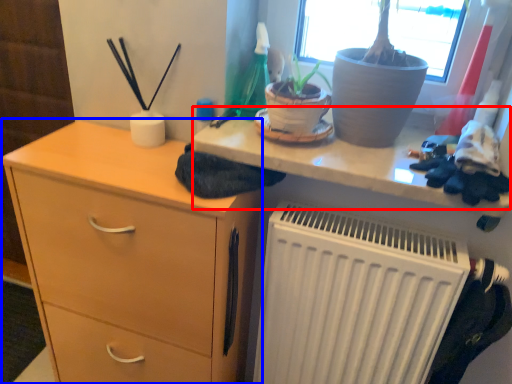
Question: Which of the following is the closest to the observer, writing desk (highlighted by a red box) or chest of drawers (highlighted by a blue box)?

Choices:
 (A) writing desk
 (B) chest of drawers

Answer: (A)